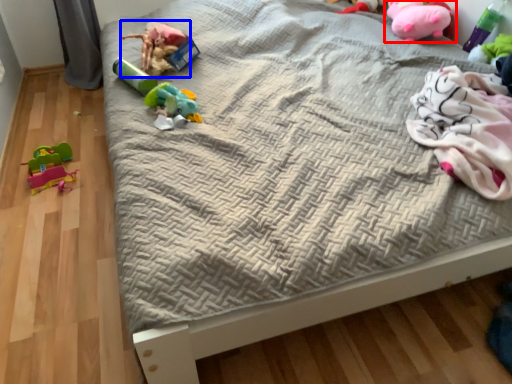
Question: Which object is closer to the camera taking this photo, toy (highlighted by a red box) or toy (highlighted by a blue box)?

Choices:
 (A) toy
 (B) toy

Answer: (B)